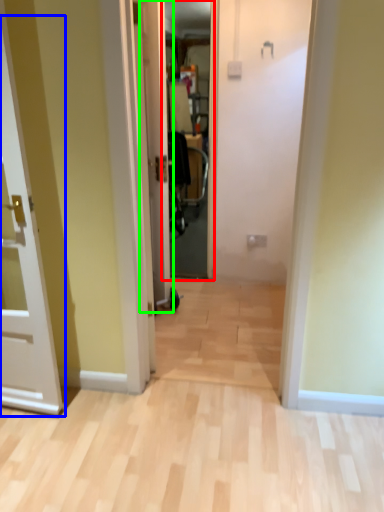
Question: Based on their relative distances, which object is farther from screen door (highlighted by a red box)? Choose from door (highlighted by a blue box) and door (highlighted by a green box).

Choices:
 (A) door
 (B) door

Answer: (A)